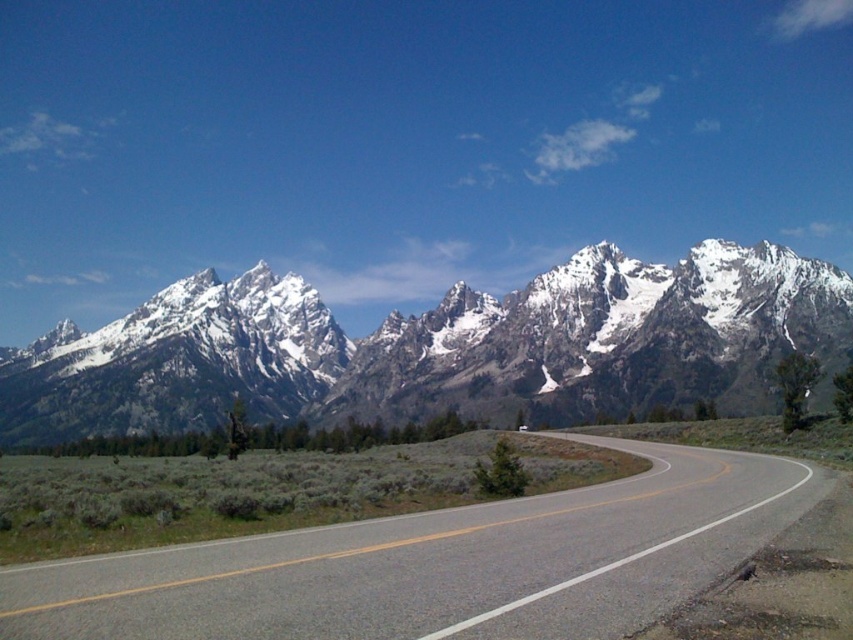
You are a hiker planning to take a photo of the snowy granite mountain range at upper center and the asphalt road at center. Which object in the scene will appear bigger in your photo?

The snowy granite mountain range at upper center will appear bigger in the photo because it has a larger size compared to the asphalt road at center according to the description.

You are a hiker planning to walk along the road from the starting point to the destination. The starting point is at point (598,342) and the destination is at point (71,632). Based on the scene description, which point is closer to the mountains in the background?

Point (598,342) is behind point (71,632), so the starting point is closer to the mountains in the background.

You are a hiker planning to take a photo of both the snowy granite mountain range at upper center and the asphalt road at center. Since you want both in the frame, which object should you position closer to the left side of your camera viewfinder?

The snowy granite mountain range at upper center is positioned on the left side of asphalt road at center. Therefore, to include both in the frame, you should position the snowy granite mountain range at upper center closer to the left side of your camera viewfinder.